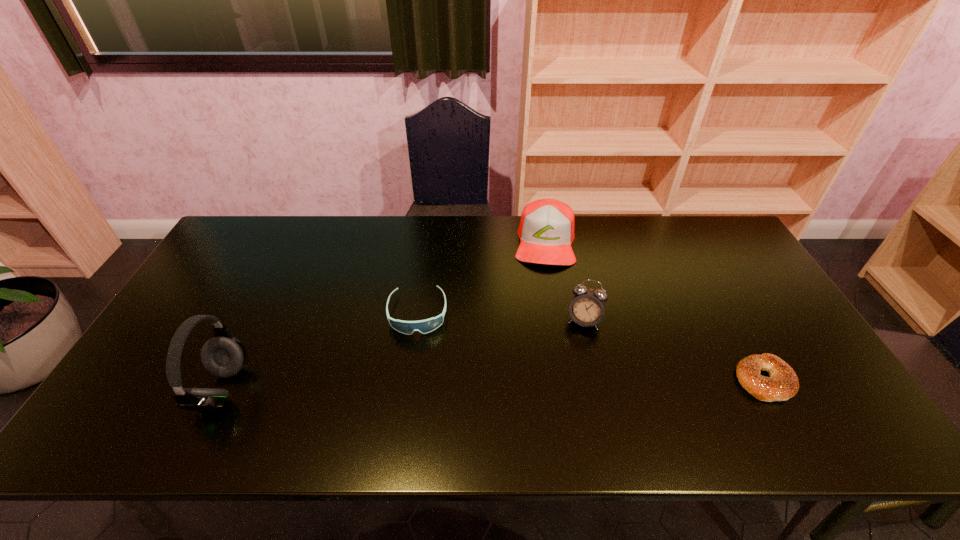
Locate an element on the screen. This screenshot has width=960, height=540. the leftmost object is located at coordinates [223, 356].

Locate an element on the screen. The height and width of the screenshot is (540, 960). headset is located at coordinates (223, 356).

Find the location of a particular element. bagel is located at coordinates (783, 384).

You are a GUI agent. You are given a task and a screenshot of the screen. Output one action in this format:
    pyautogui.click(x=<x>, y=<y>)
    Task: Click on the shortest object
    
    Given the screenshot: What is the action you would take?
    pyautogui.click(x=783, y=384)

At what (x,y) coordinates should I click in order to perform the action: click on goggles. Please return your answer as a coordinate pair (x, y). Looking at the image, I should click on (425, 326).

Find the location of a particular element. The image size is (960, 540). the fourth object from right to left is located at coordinates (425, 326).

Where is `the farthest object`? The height and width of the screenshot is (540, 960). the farthest object is located at coordinates (546, 230).

This screenshot has width=960, height=540. Identify the location of alarm clock. 587,307.

You are a GUI agent. You are given a task and a screenshot of the screen. Output one action in this format:
    pyautogui.click(x=<x>, y=<y>)
    Task: Click on the vacant space located 0.120m on the ear cups of the leftmost object
    The width and height of the screenshot is (960, 540).
    Given the screenshot: What is the action you would take?
    pyautogui.click(x=292, y=388)

The width and height of the screenshot is (960, 540). Identify the location of vacant space situated on the back of the bagel. (716, 294).